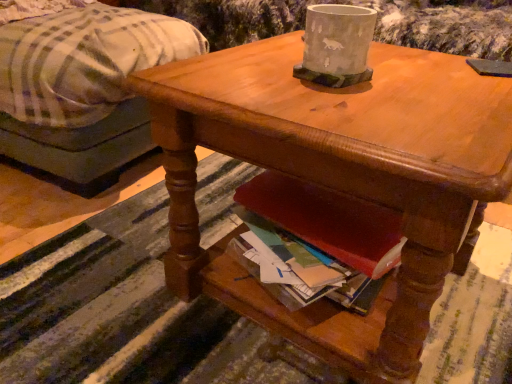
What do you see at coordinates (336, 45) in the screenshot?
I see `gray concrete pot at upper center` at bounding box center [336, 45].

Describe the element at coordinates (79, 148) in the screenshot. Image resolution: width=512 pixels, height=384 pixels. I see `plaid fabric ottoman at left` at that location.

This screenshot has height=384, width=512. I want to click on gray concrete pot at upper center, so click(336, 45).

In the image, is plaid fabric ottoman at left positioned in front of or behind gray concrete pot at upper center?

Clearly, plaid fabric ottoman at left is behind gray concrete pot at upper center.

Is point (42, 145) farther from camera compared to point (341, 38)?

Yes, it is behind point (341, 38).

Consider the image. From the image's perspective, is plaid fabric ottoman at left beneath gray concrete pot at upper center?

Incorrect, from the image's perspective, plaid fabric ottoman at left is higher than gray concrete pot at upper center.

In the scene shown: From a real-world perspective, relative to gray concrete pot at upper center, is plaid fabric ottoman at left vertically above or below?

plaid fabric ottoman at left is below gray concrete pot at upper center.

From the image's perspective, who appears lower, wooden desk at center or plaid fabric ottoman at left?

wooden desk at center.

Which of these two, wooden desk at center or plaid fabric ottoman at left, is wider?

plaid fabric ottoman at left is wider.

What's the angular difference between wooden desk at center and plaid fabric ottoman at left's facing directions?

9.7 degrees.

Would you say plaid fabric ottoman at left is part of wooden desk at center's contents?

No, plaid fabric ottoman at left is located outside of wooden desk at center.

Based on their positions, is gray concrete pot at upper center located to the left or right of wooden desk at center?

From the image, it's evident that gray concrete pot at upper center is to the left of wooden desk at center.

What's the angular difference between gray concrete pot at upper center and wooden desk at center's facing directions?

0.213 degrees.

Is gray concrete pot at upper center completely or partially outside of wooden desk at center?

Yes.

Who is taller, gray concrete pot at upper center or wooden desk at center?

wooden desk at center.

Would you say wooden desk at center is part of plaid fabric ottoman at left's contents?

No, plaid fabric ottoman at left does not contain wooden desk at center.

Is plaid fabric ottoman at left beside wooden desk at center?

No, plaid fabric ottoman at left is not beside wooden desk at center.

Is point (115, 117) closer or farther from the camera than point (447, 68)?

Point (115, 117) appears to be farther away from the viewer than point (447, 68).

From the image's perspective, which is above, gray concrete pot at upper center or plaid fabric ottoman at left?

plaid fabric ottoman at left, from the image's perspective.

You are a GUI agent. You are given a task and a screenshot of the screen. Output one action in this format:
    pyautogui.click(x=<x>, y=<y>)
    Task: Click on the studio couch that appears behind the gray concrete pot at upper center
    The width and height of the screenshot is (512, 384).
    Given the screenshot: What is the action you would take?
    pyautogui.click(x=79, y=148)

Is gray concrete pot at upper center completely or partially outside of plaid fabric ottoman at left?

Yes, gray concrete pot at upper center is outside of plaid fabric ottoman at left.

Considering the positions of point (327, 73) and point (69, 183), is point (327, 73) closer or farther from the camera than point (69, 183)?

Point (327, 73) is closer to the camera than point (69, 183).

Considering the relative sizes of wooden desk at center and gray concrete pot at upper center in the image provided, is wooden desk at center wider than gray concrete pot at upper center?

Correct, the width of wooden desk at center exceeds that of gray concrete pot at upper center.

Which is behind, wooden desk at center or gray concrete pot at upper center?

Positioned behind is gray concrete pot at upper center.

From the image's perspective, which is above, wooden desk at center or gray concrete pot at upper center?

gray concrete pot at upper center.

Is wooden desk at center positioned with its back to gray concrete pot at upper center?

No.

Find the location of a particular element. The width and height of the screenshot is (512, 384). coffee cup in front of the plaid fabric ottoman at left is located at coordinates (336, 45).

At what (x,y) coordinates should I click in order to perform the action: click on desk that is below the plaid fabric ottoman at left (from the image's perspective). Please return your answer as a coordinate pair (x, y). Looking at the image, I should click on (337, 177).

From the image, which object appears to be farther from wooden desk at center, plaid fabric ottoman at left or gray concrete pot at upper center?

Among the two, plaid fabric ottoman at left is located further to wooden desk at center.

Which object lies nearer to the anchor point plaid fabric ottoman at left, wooden desk at center or gray concrete pot at upper center?

wooden desk at center lies closer to plaid fabric ottoman at left than the other object.

Considering their positions, is gray concrete pot at upper center positioned closer to wooden desk at center than plaid fabric ottoman at left?

The object closer to wooden desk at center is gray concrete pot at upper center.

Estimate the real-world distances between objects in this image. Which object is closer to gray concrete pot at upper center, wooden desk at center or plaid fabric ottoman at left?

The object closer to gray concrete pot at upper center is wooden desk at center.

Considering their positions, is plaid fabric ottoman at left positioned closer to gray concrete pot at upper center than wooden desk at center?

wooden desk at center is closer to gray concrete pot at upper center.

Looking at the image, which one is located further to plaid fabric ottoman at left, gray concrete pot at upper center or wooden desk at center?

gray concrete pot at upper center.

Locate an element on the screen. coffee cup between plaid fabric ottoman at left and wooden desk at center is located at coordinates (336, 45).